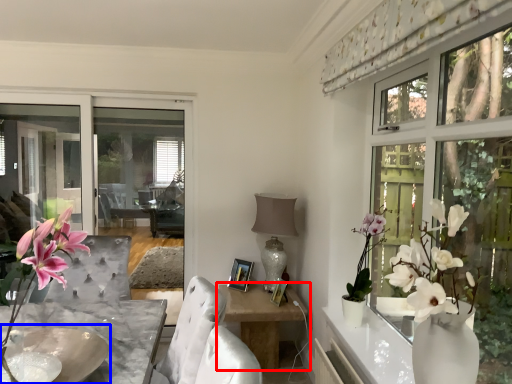
Question: Which object is closer to the camera taking this photo, table (highlighted by a red box) or round table (highlighted by a blue box)?

Choices:
 (A) table
 (B) round table

Answer: (B)